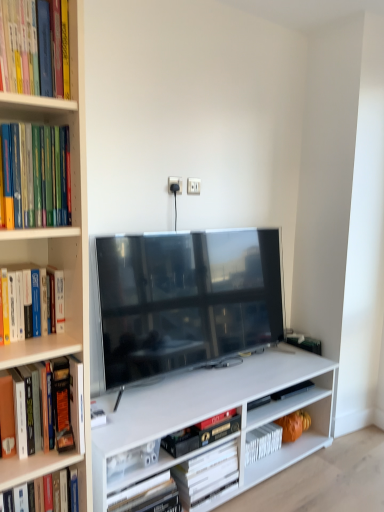
Question: From the image's perspective, is matte black tv at center above or below hardcover books at left, positioned as the 2th book in top-to-bottom order?

Choices:
 (A) above
 (B) below

Answer: (B)

Question: From a real-world perspective, is matte black tv at center positioned above or below hardcover books at left, positioned as the 2th book in top-to-bottom order?

Choices:
 (A) below
 (B) above

Answer: (A)

Question: Considering the real-world distances, which object is farthest from the hardcover book at upper left, the fourth book in the back-to-front sequence?

Choices:
 (A) hardcover books at left, the second book from the front
 (B) hardcover book at center, which is the 3th book in top-to-bottom order
 (C) matte black tv at center
 (D) hardcover book at lower center, the 4th book viewed from the front

Answer: (D)

Question: Estimate the real-world distances between objects in this image. Which object is farther from the matte black tv at center?

Choices:
 (A) hardcover book at center, which is the 3th book in top-to-bottom order
 (B) hardcover books at left, marked as the 3th book in a back-to-front arrangement
 (C) hardcover book at lower center, the first book from the back
 (D) hardcover book at upper left, which ranks as the 1th book in top-to-bottom order

Answer: (D)